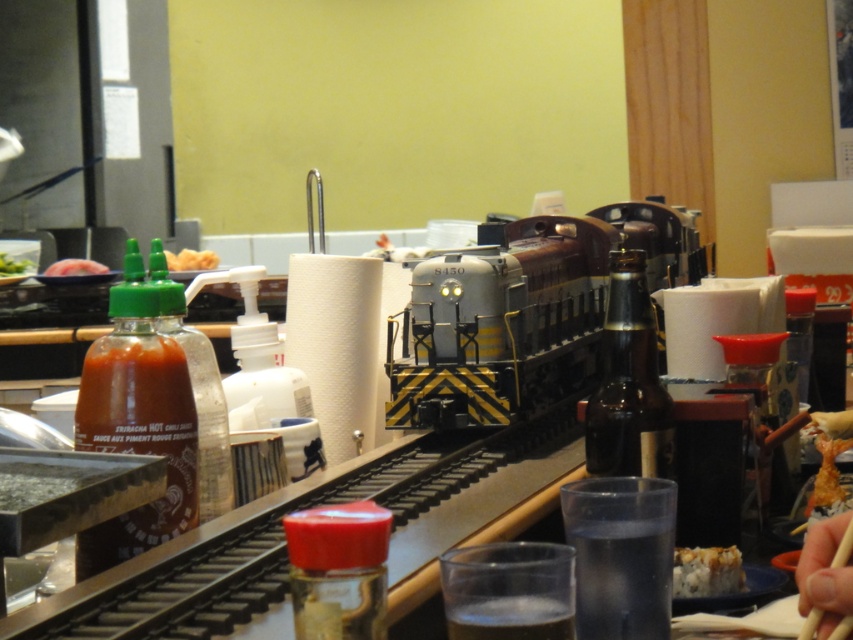
You are a customer at the dining establishment and want to place your drink on the clear glass at center. Where exactly should you place it?

The clear glass at center is located at point (511, 618), so you should place your drink there.

In the scene shown: You are a customer at this sushi bar and want to place your chopsticks next to your glass. Given the objects in the scene, can you fit both the clear glass at center and the skinny chopsticks at center side by side on the table without overlapping?

The clear glass at center is wider than the skinny chopsticks at center. Since the glass is wider, there should be enough space to place both side by side as long as the total width of both items doesn not exceed the table s available space.